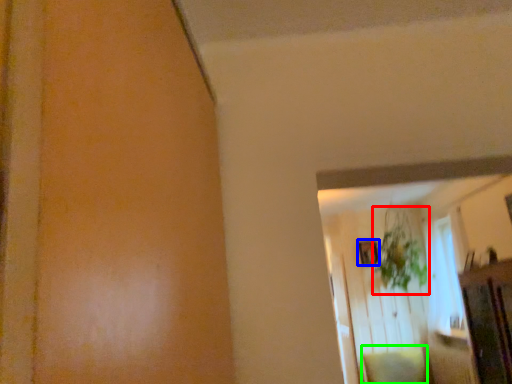
Question: Considering the real-world distances, which object is closest to plant (highlighted by a red box)? picture frame (highlighted by a blue box) or pillow (highlighted by a green box).

Choices:
 (A) picture frame
 (B) pillow

Answer: (A)